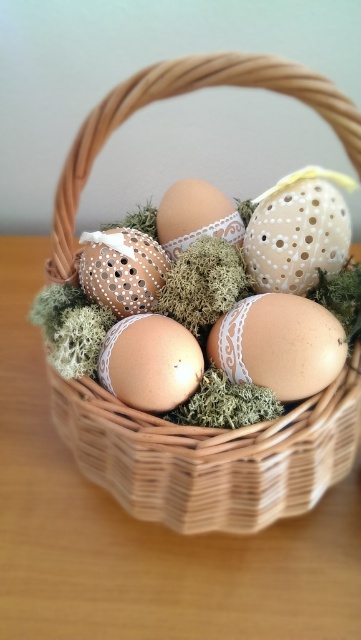
You are placing a small figurine that is 3 inches wide on the wooden table at center. The matte white lace egg at center is currently on the table. Can the figurine be placed next to the egg without moving it?

The wooden table at center and matte white lace egg at center are 12.93 inches apart. Since the figurine is only 3 inches wide, there is enough space to place it next to the egg on the wooden table at center without moving the egg.

You have a rectangular tray that is 30 cm wide. You want to place it on the wooden table at center so that it doesn not extend beyond the table edges. Considering the woven wood basket at center is already on the table, can the tray fit on the table without overlapping the basket?

The wooden table at center is wider than the woven wood basket at center, so there is enough space to place the 30 cm wide tray on the wooden table at center without overlapping the basket.